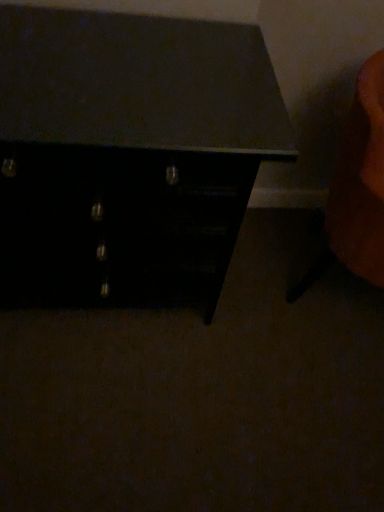
Question: Could matte black chest of drawers at center be considered to be inside orange fabric swivel chair at right?

Choices:
 (A) no
 (B) yes

Answer: (A)

Question: Is orange fabric swivel chair at right turned away from matte black chest of drawers at center?

Choices:
 (A) no
 (B) yes

Answer: (B)

Question: From a real-world perspective, is orange fabric swivel chair at right under matte black chest of drawers at center?

Choices:
 (A) no
 (B) yes

Answer: (B)

Question: Considering the relative sizes of orange fabric swivel chair at right and matte black chest of drawers at center in the image provided, is orange fabric swivel chair at right taller than matte black chest of drawers at center?

Choices:
 (A) yes
 (B) no

Answer: (B)

Question: Does orange fabric swivel chair at right have a greater width compared to matte black chest of drawers at center?

Choices:
 (A) yes
 (B) no

Answer: (B)

Question: Is orange fabric swivel chair at right positioned far away from matte black chest of drawers at center?

Choices:
 (A) yes
 (B) no

Answer: (B)

Question: Can you confirm if matte black chest of drawers at center is positioned to the right of orange fabric swivel chair at right?

Choices:
 (A) yes
 (B) no

Answer: (B)

Question: From the image's perspective, is matte black chest of drawers at center above orange fabric swivel chair at right?

Choices:
 (A) no
 (B) yes

Answer: (B)

Question: Could orange fabric swivel chair at right be considered to be inside matte black chest of drawers at center?

Choices:
 (A) no
 (B) yes

Answer: (A)

Question: Is matte black chest of drawers at center facing away from orange fabric swivel chair at right?

Choices:
 (A) no
 (B) yes

Answer: (A)

Question: Is matte black chest of drawers at center located outside orange fabric swivel chair at right?

Choices:
 (A) yes
 (B) no

Answer: (A)

Question: Can you confirm if matte black chest of drawers at center is smaller than orange fabric swivel chair at right?

Choices:
 (A) yes
 (B) no

Answer: (B)

Question: From the image's perspective, relative to orange fabric swivel chair at right, is matte black chest of drawers at center above or below?

Choices:
 (A) below
 (B) above

Answer: (B)